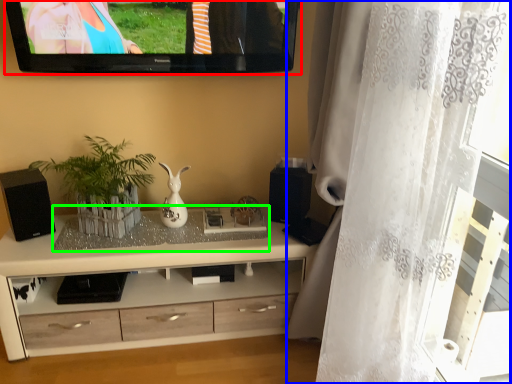
Question: Based on their relative distances, which object is nearer to television (highlighted by a red box)? Choose from curtain (highlighted by a blue box) and glass table (highlighted by a green box).

Choices:
 (A) curtain
 (B) glass table

Answer: (B)